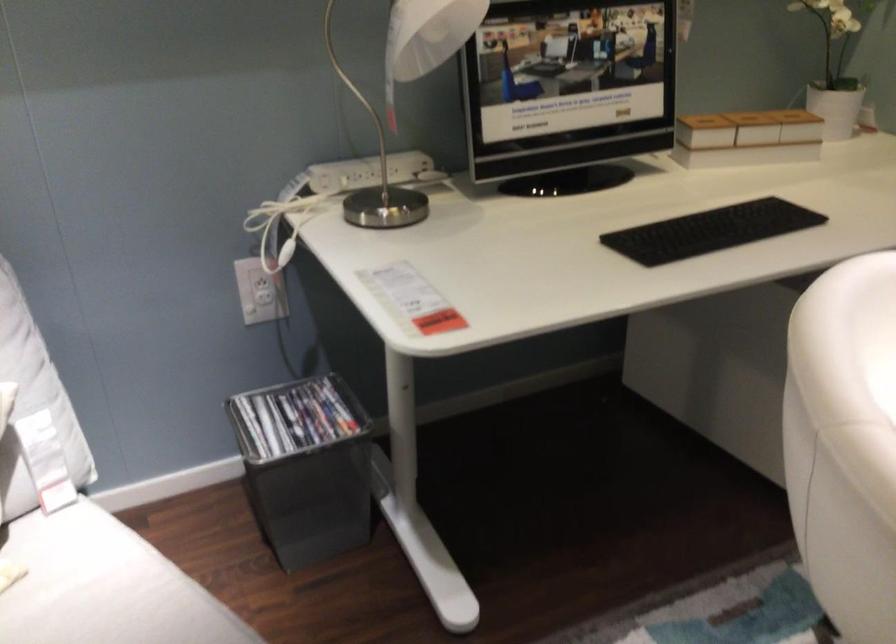
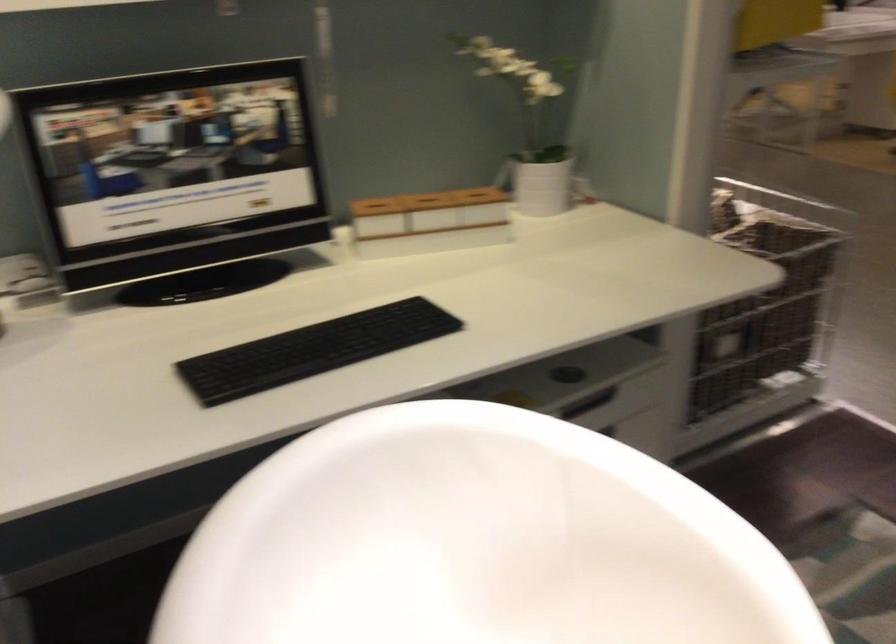
Locate, in the second image, the point that corresponds to point (711, 117) in the first image.

(375, 204)